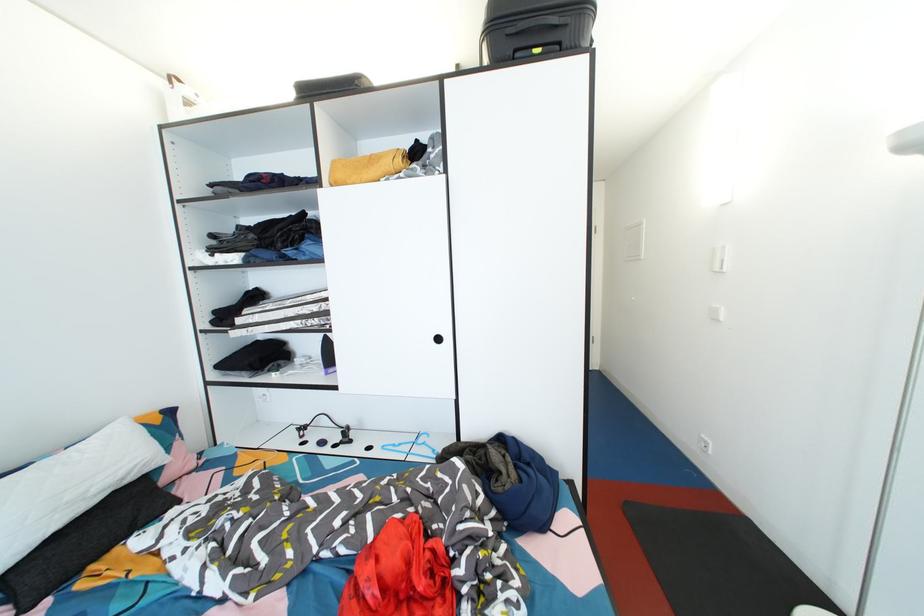
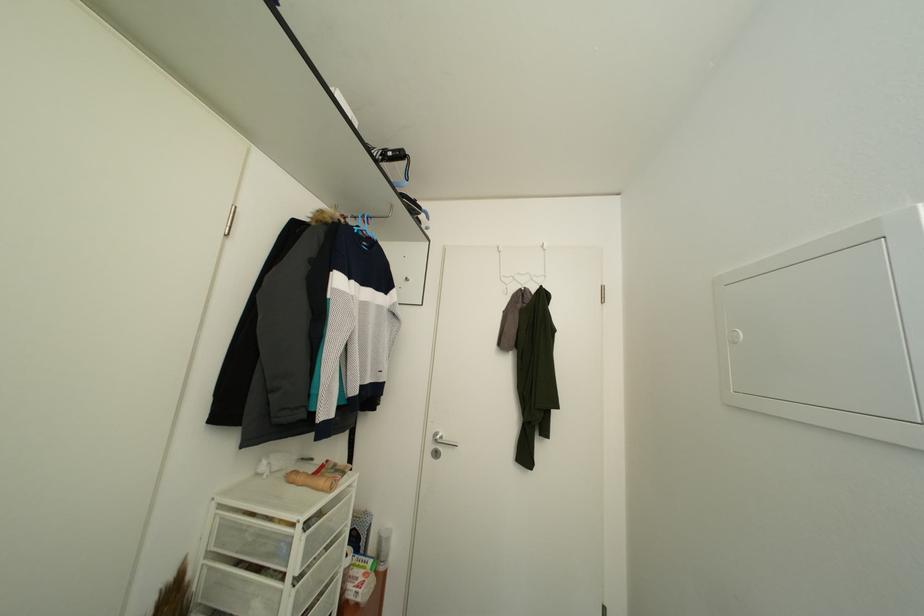
What movement of the cameraman would produce the second image?

The cameraman moved toward right, forward.